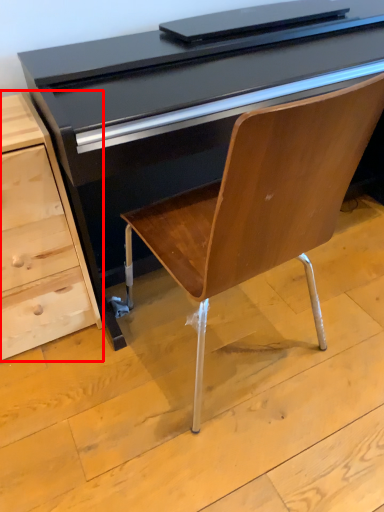
Question: From the image's perspective, what is the correct spatial relationship of chest of drawers (annotated by the red box) in relation to desk?

Choices:
 (A) below
 (B) above

Answer: (A)